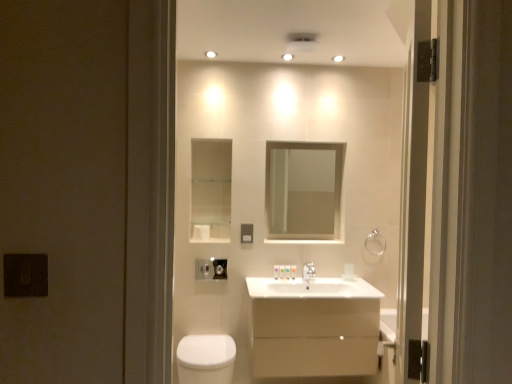
Locate an element on the screen. The width and height of the screenshot is (512, 384). vacant space situated on the left part of white glossy toiletries at center, the second toiletry viewed from the left is located at coordinates (269, 280).